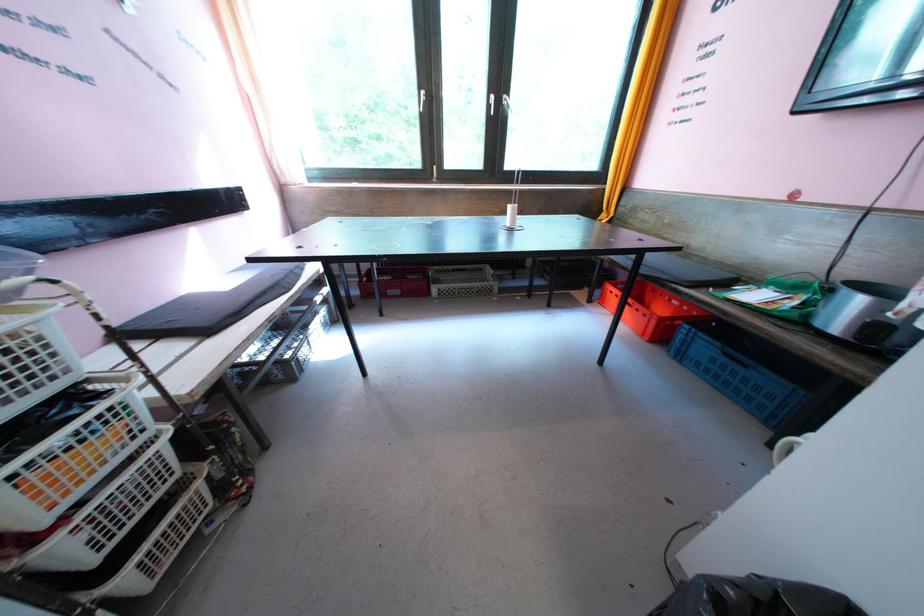
The height and width of the screenshot is (616, 924). Find the location of `the left white window handle`. the left white window handle is located at coordinates (420, 100).